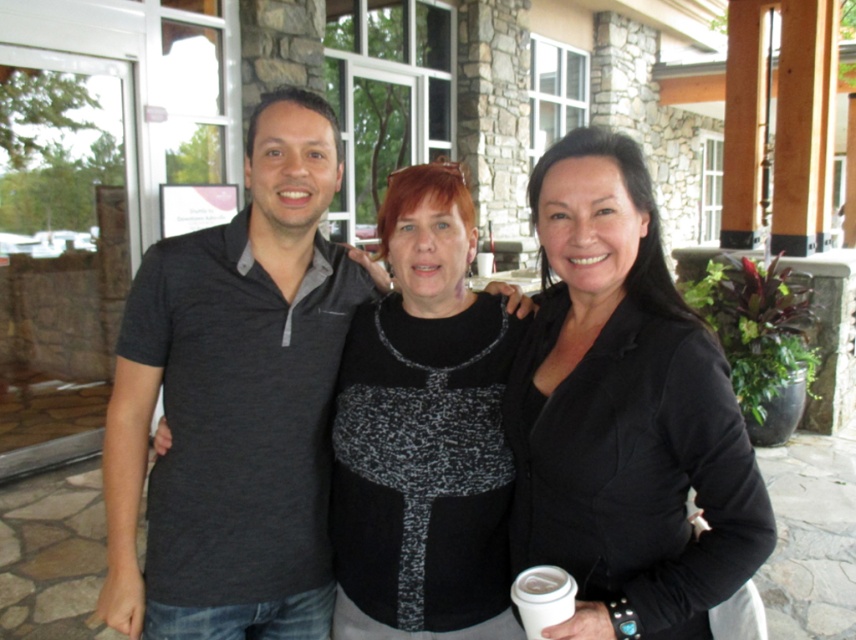
Does dark gray jersey at center lie behind black matte blazer at center?

Yes, it is.

Does point (319, 348) come farther from viewer compared to point (545, 424)?

Yes, it is behind point (545, 424).

This screenshot has height=640, width=856. I want to click on dark gray jersey at center, so click(x=235, y=403).

Consider the image. Can you confirm if dark gray jersey at center is shorter than dark gray shirt at center?

No, dark gray jersey at center is not shorter than dark gray shirt at center.

Is point (152, 477) more distant than point (514, 381)?

Yes.

You are a GUI agent. You are given a task and a screenshot of the screen. Output one action in this format:
    pyautogui.click(x=<x>, y=<y>)
    Task: Click on the dark gray jersey at center
    
    Given the screenshot: What is the action you would take?
    pyautogui.click(x=235, y=403)

Which is in front, point (182, 483) or point (477, 486)?

Positioned in front is point (477, 486).

Between dark gray jersey at center and speckled knit sweater at center, which one appears on the right side from the viewer's perspective?

speckled knit sweater at center is more to the right.

Where is `dark gray jersey at center`? The width and height of the screenshot is (856, 640). dark gray jersey at center is located at coordinates (235, 403).